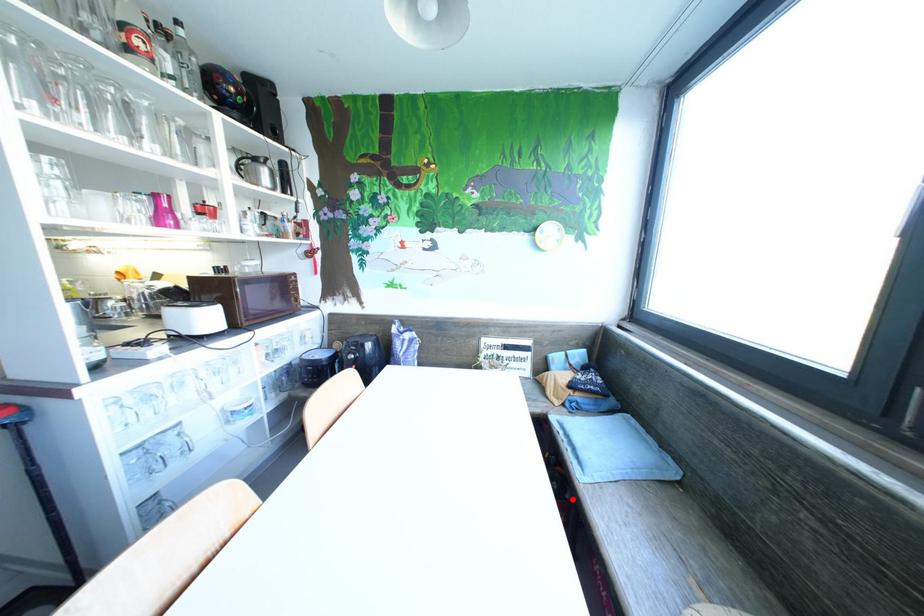
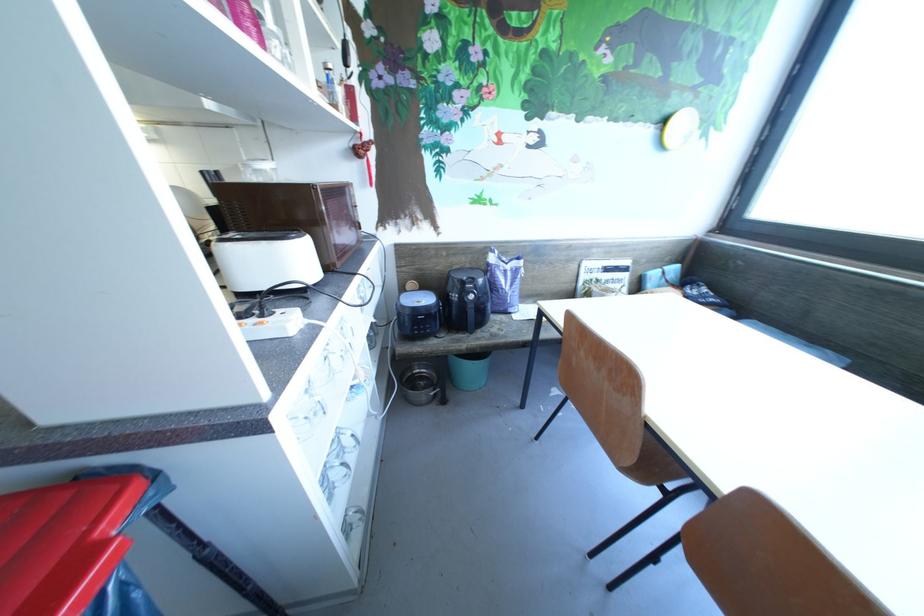
Question: I am providing you with two images of the same scene from different viewpoints. A red point is marked on the first image. At the location where the point appears in image 1, is it still visible in image 2?

Choices:
 (A) Yes
 (B) No

Answer: (B)